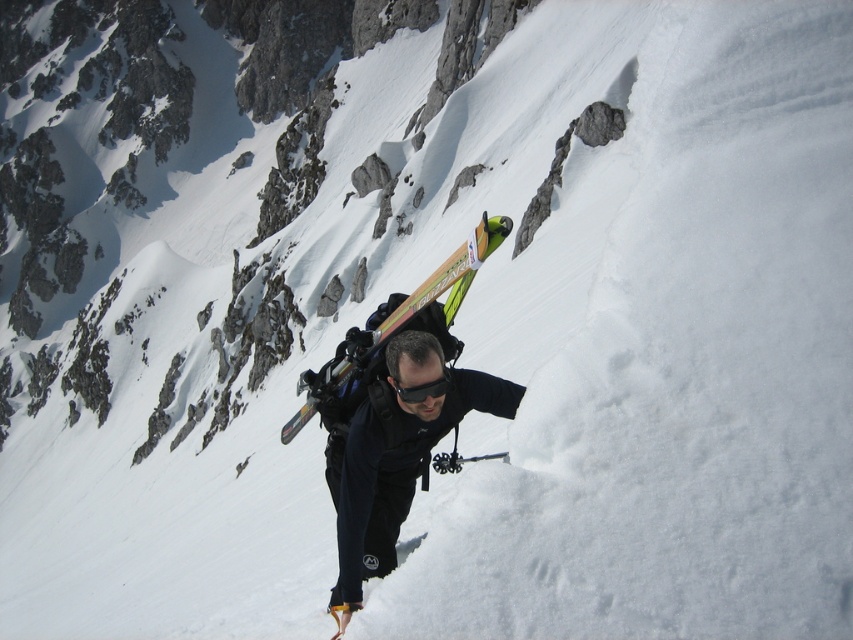
Question: In this image, where is matte wood ski at center located relative to black matte goggles at center?

Choices:
 (A) right
 (B) left

Answer: (B)

Question: Which point is closer to the camera?

Choices:
 (A) (422, 442)
 (B) (440, 388)
 (C) (341, 362)

Answer: (B)

Question: Based on their relative distances, which object is farther from the black matte jacket at center?

Choices:
 (A) black matte goggles at center
 (B) matte wood ski at center

Answer: (B)

Question: Is black matte jacket at center smaller than black matte goggles at center?

Choices:
 (A) yes
 (B) no

Answer: (B)

Question: In this image, where is matte wood ski at center located relative to black matte goggles at center?

Choices:
 (A) right
 (B) left

Answer: (B)

Question: Which of these objects is positioned closest to the black matte jacket at center?

Choices:
 (A) matte wood ski at center
 (B) black matte goggles at center

Answer: (B)